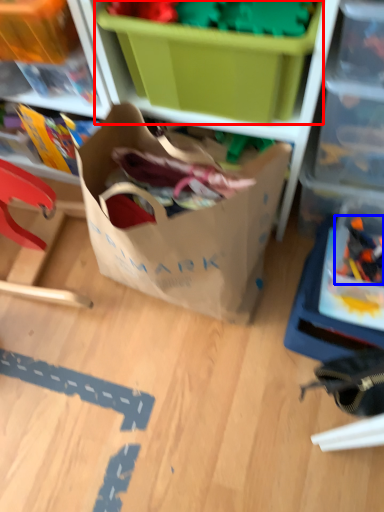
Question: Which of the following is the farthest to the observer, storage box (highlighted by a red box) or toy (highlighted by a blue box)?

Choices:
 (A) storage box
 (B) toy

Answer: (B)